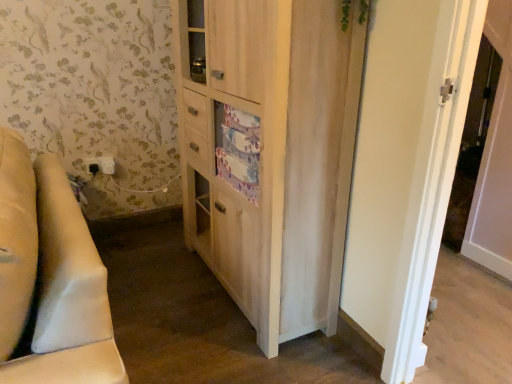
Question: Considering the relative positions of light wood cabinet at center and green leafy plant at upper center in the image provided, is light wood cabinet at center in front of green leafy plant at upper center?

Choices:
 (A) no
 (B) yes

Answer: (A)

Question: Would you say light wood cabinet at center contains green leafy plant at upper center?

Choices:
 (A) yes
 (B) no

Answer: (B)

Question: From the image's perspective, would you say light wood cabinet at center is shown under green leafy plant at upper center?

Choices:
 (A) yes
 (B) no

Answer: (A)

Question: Can you confirm if light wood cabinet at center is positioned to the right of green leafy plant at upper center?

Choices:
 (A) no
 (B) yes

Answer: (A)

Question: From the image's perspective, is light wood cabinet at center on green leafy plant at upper center?

Choices:
 (A) yes
 (B) no

Answer: (B)

Question: Can you confirm if light wood cabinet at center is thinner than green leafy plant at upper center?

Choices:
 (A) no
 (B) yes

Answer: (A)

Question: Does white plastic screen door at upper right turn towards beige fabric couch at left?

Choices:
 (A) no
 (B) yes

Answer: (B)

Question: From the image's perspective, is white plastic screen door at upper right located above beige fabric couch at left?

Choices:
 (A) yes
 (B) no

Answer: (A)

Question: Does white plastic screen door at upper right contain beige fabric couch at left?

Choices:
 (A) no
 (B) yes

Answer: (A)

Question: Is white plastic screen door at upper right closer to camera compared to beige fabric couch at left?

Choices:
 (A) no
 (B) yes

Answer: (A)

Question: Does white plastic screen door at upper right have a greater height compared to beige fabric couch at left?

Choices:
 (A) yes
 (B) no

Answer: (A)

Question: Is white plastic screen door at upper right touching beige fabric couch at left?

Choices:
 (A) yes
 (B) no

Answer: (B)

Question: Is green leafy plant at upper center smaller than light wood cabinet at center?

Choices:
 (A) yes
 (B) no

Answer: (A)